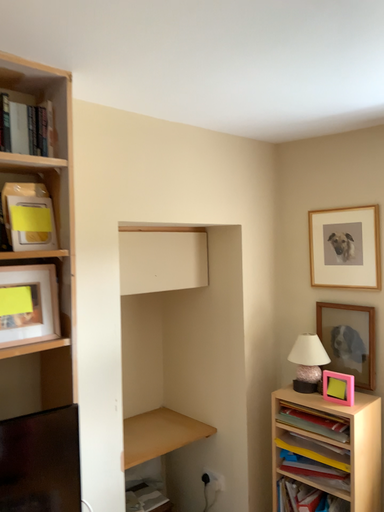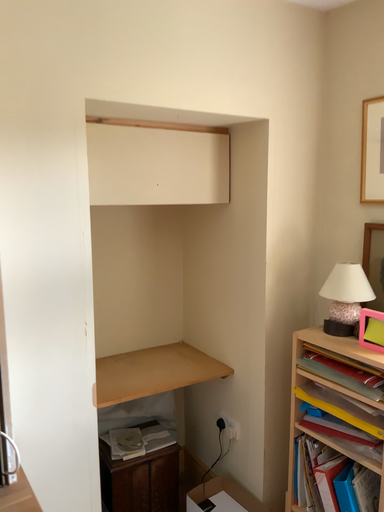
Question: How did the camera likely rotate when shooting the video?

Choices:
 (A) rotated upward
 (B) rotated downward

Answer: (B)